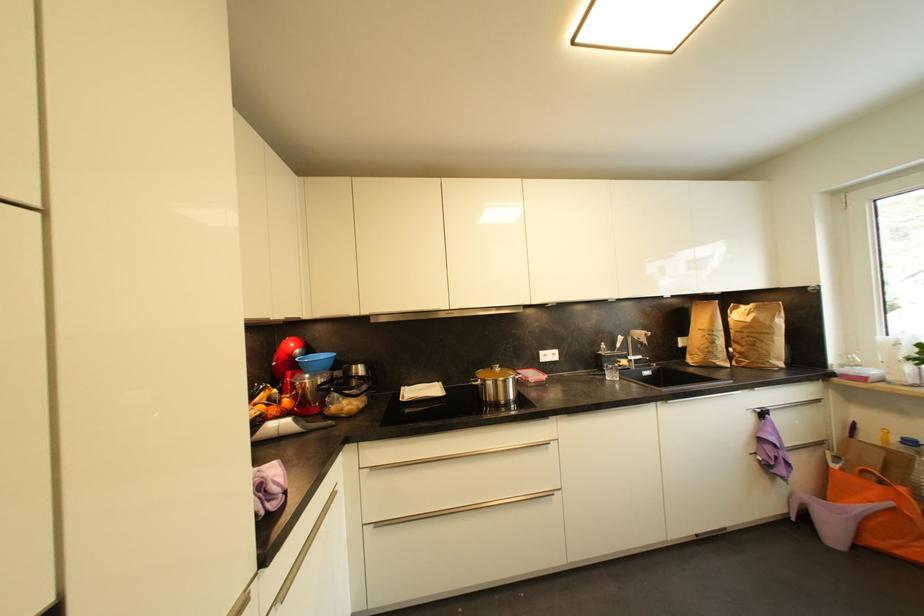
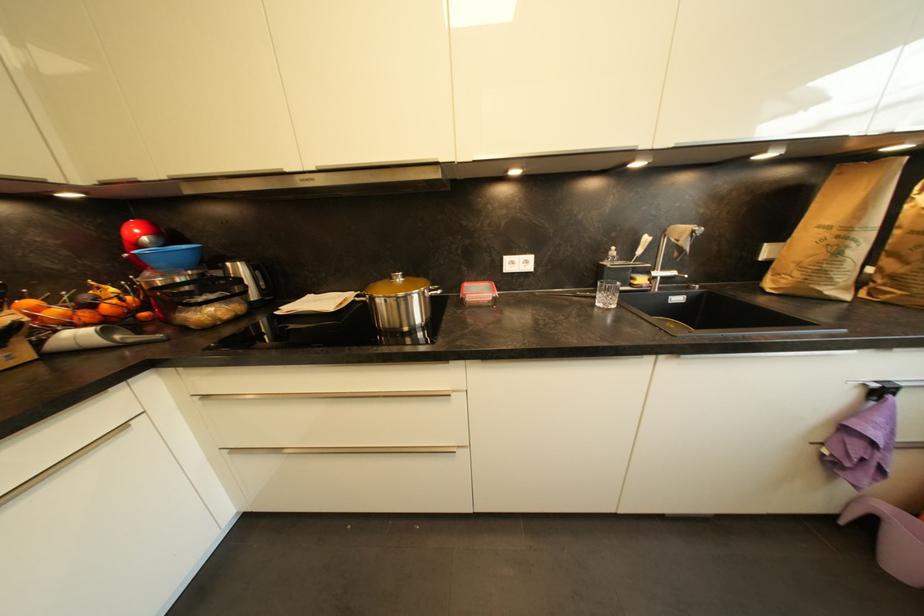
Consider the image. In a continuous first-person perspective shot, in which direction is the camera moving?

The movement direction of the cameraman is right, forward.